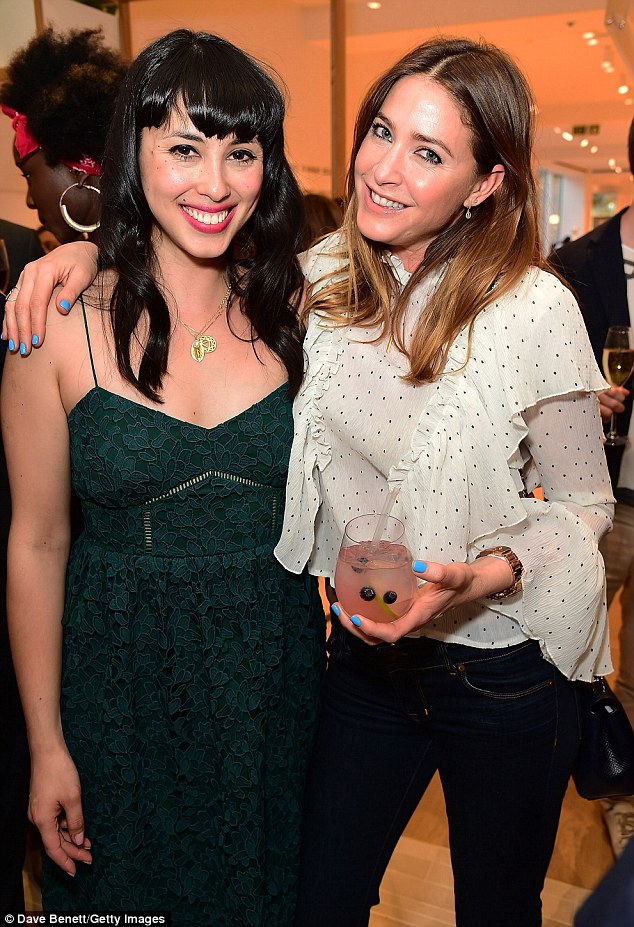
Identify the location of pendant. This screenshot has height=927, width=634. (195, 347), (210, 343).